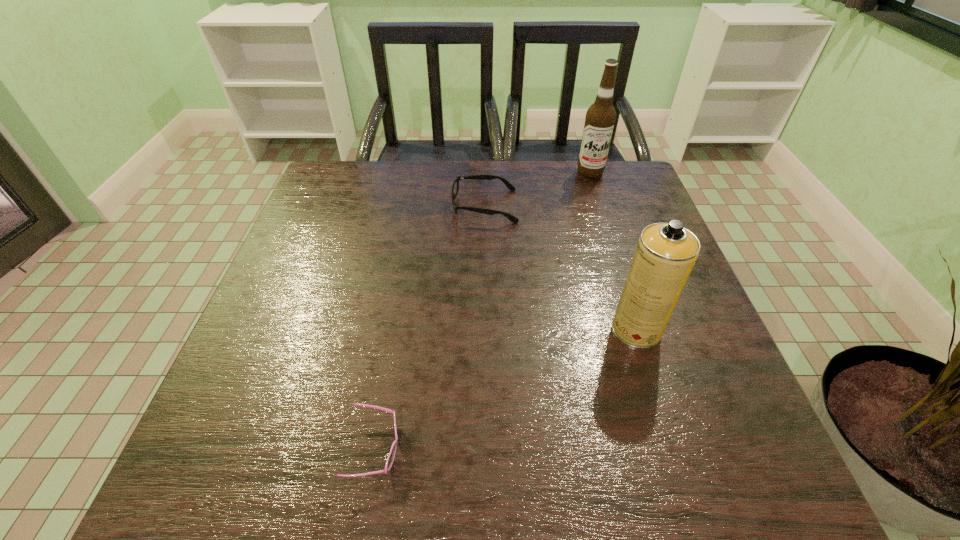
Identify the location of free region at the near edge of the desktop. This screenshot has width=960, height=540. (592, 449).

Locate an element on the screen. The width and height of the screenshot is (960, 540). vacant space at the left edge is located at coordinates (264, 397).

Find the location of a particular element. The height and width of the screenshot is (540, 960). vacant space at the right edge of the desktop is located at coordinates pyautogui.click(x=693, y=307).

Find the location of a particular element. The width and height of the screenshot is (960, 540). blank space at the far left corner of the desktop is located at coordinates (328, 164).

I want to click on free point between the alcohol and the second tallest object, so click(613, 251).

You are a GUI agent. You are given a task and a screenshot of the screen. Output one action in this format:
    pyautogui.click(x=<x>, y=<y>)
    Task: Click on the blank region between the third shortest object and the farthest object
    The image size is (960, 540).
    Given the screenshot: What is the action you would take?
    pyautogui.click(x=613, y=251)

Identify the location of unoccupied area between the alcohol and the sunglasses. (483, 310).

This screenshot has height=540, width=960. In order to click on empty location between the third nearest object and the second nearest object in this screenshot , I will do point(561,268).

You are a GUI agent. You are given a task and a screenshot of the screen. Output one action in this format:
    pyautogui.click(x=<x>, y=<y>)
    Task: Click on the free spot between the spectacles and the aerosol can
    This screenshot has height=540, width=960.
    Given the screenshot: What is the action you would take?
    click(561, 268)

Where is `vacant area that lies between the alcohol and the aerosol can`? The image size is (960, 540). vacant area that lies between the alcohol and the aerosol can is located at coordinates (613, 251).